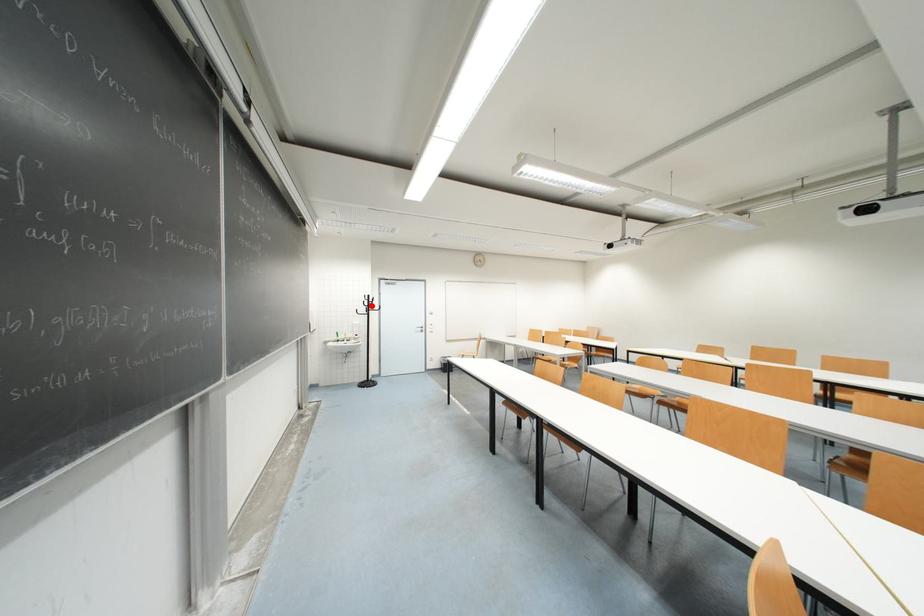
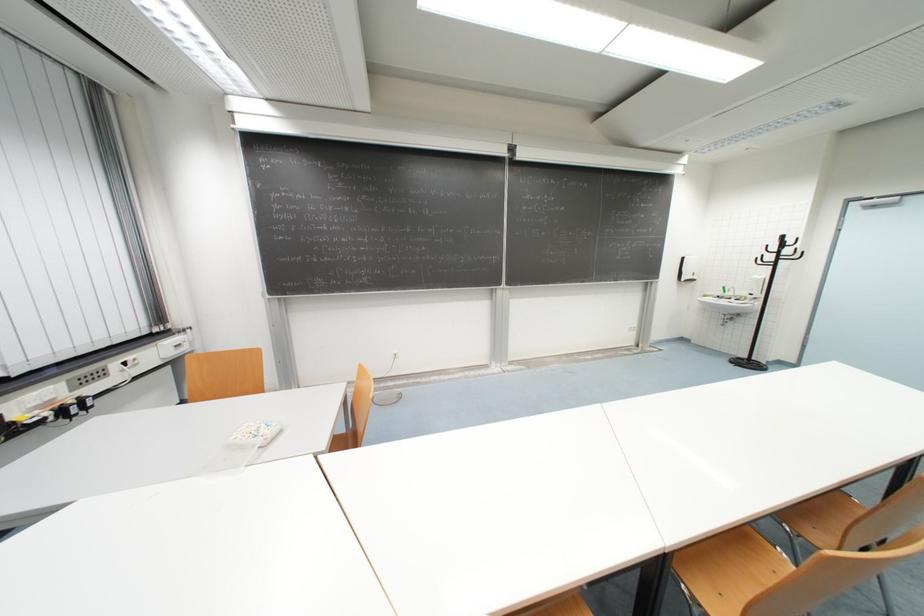
The point at the highlighted location is marked in the first image. Where is the corresponding point in the second image?

(779, 251)